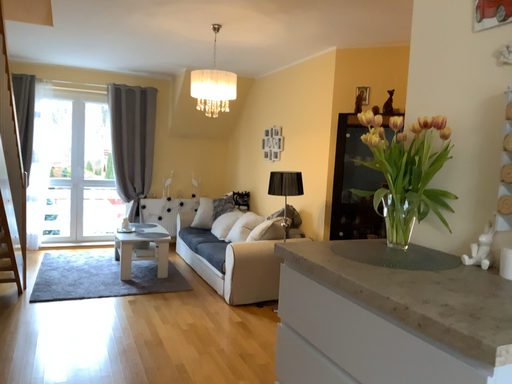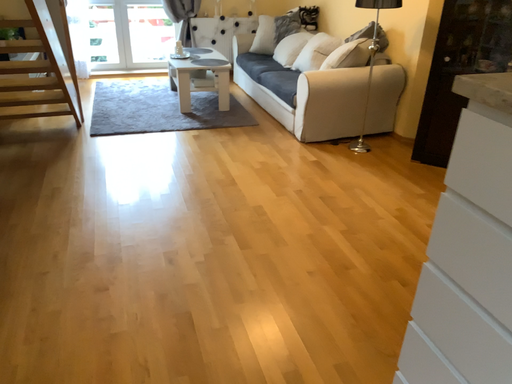
Question: How did the camera likely rotate when shooting the video?

Choices:
 (A) rotated upward
 (B) rotated downward

Answer: (B)